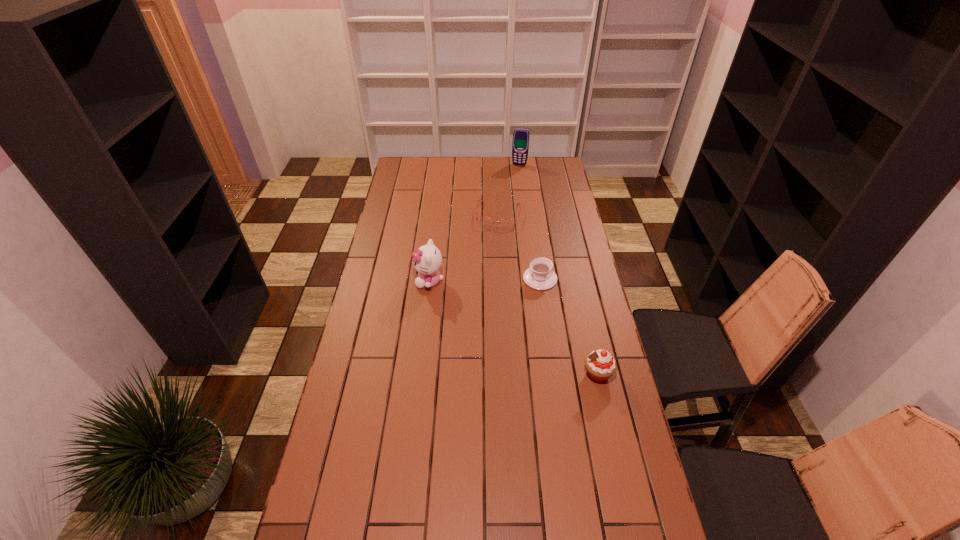
Locate an element on the screen. The width and height of the screenshot is (960, 540). the leftmost object is located at coordinates (427, 260).

Identify the location of the fourth shortest object. pos(427,260).

This screenshot has width=960, height=540. I want to click on the rightmost object, so click(x=600, y=365).

Locate an element on the screen. the nearest object is located at coordinates (600, 365).

Where is `the shortest object`? the shortest object is located at coordinates (483, 220).

The width and height of the screenshot is (960, 540). In order to click on the second farthest object in this screenshot , I will do `click(483, 220)`.

Image resolution: width=960 pixels, height=540 pixels. Find the location of `teacup`. teacup is located at coordinates (540, 276).

Where is `the farthest object`? the farthest object is located at coordinates (520, 145).

Where is `free space located 0.080m on the front-facing side of the leftmost object`? free space located 0.080m on the front-facing side of the leftmost object is located at coordinates (396, 281).

Where is `vacant space situated 0.060m on the front-facing side of the leftmost object`? vacant space situated 0.060m on the front-facing side of the leftmost object is located at coordinates (400, 281).